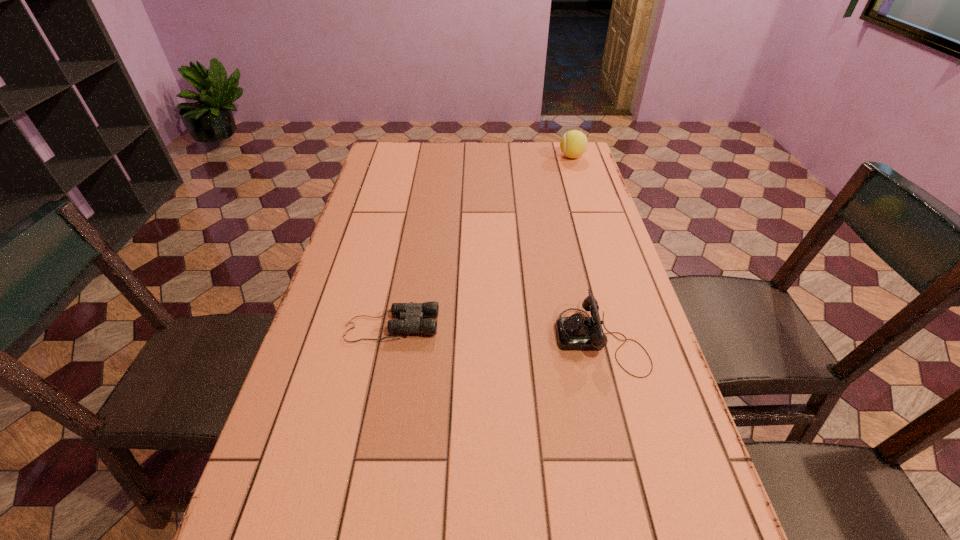
Identify the location of the tallest object. This screenshot has width=960, height=540. (573, 144).

Where is `tennis ball`? Image resolution: width=960 pixels, height=540 pixels. tennis ball is located at coordinates coord(573,144).

The height and width of the screenshot is (540, 960). Identify the location of telephone. (576, 332).

Where is `binoculars`? binoculars is located at coordinates (413, 313).

Identify the location of the leftmost object. The image size is (960, 540). (x=413, y=313).

You are a GUI agent. You are given a task and a screenshot of the screen. Output one action in this format:
    pyautogui.click(x=<x>, y=<y>)
    Task: Click on the free space located on the front of the farthest object
    Image resolution: width=960 pixels, height=540 pixels.
    Given the screenshot: What is the action you would take?
    pyautogui.click(x=578, y=177)

Locate an element on the screen. Image resolution: width=960 pixels, height=540 pixels. vacant space located 0.160m on the front-facing side of the second tallest object is located at coordinates coord(488,338).

The image size is (960, 540). I want to click on vacant space located on the front-facing side of the second tallest object, so click(441, 338).

The width and height of the screenshot is (960, 540). I want to click on free location located on the front-facing side of the second tallest object, so click(x=406, y=338).

Image resolution: width=960 pixels, height=540 pixels. Identify the location of blank space located 0.060m at the eyepiece of the leftmost object. (463, 326).